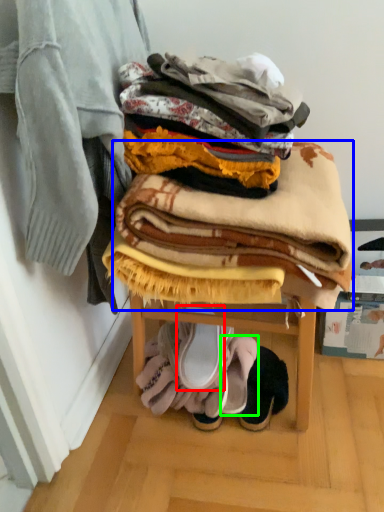
Question: Which object is positioned closest to footwear (highlighted by a red box)? Select from blanket (highlighted by a blue box) and footwear (highlighted by a green box).

Choices:
 (A) blanket
 (B) footwear

Answer: (B)